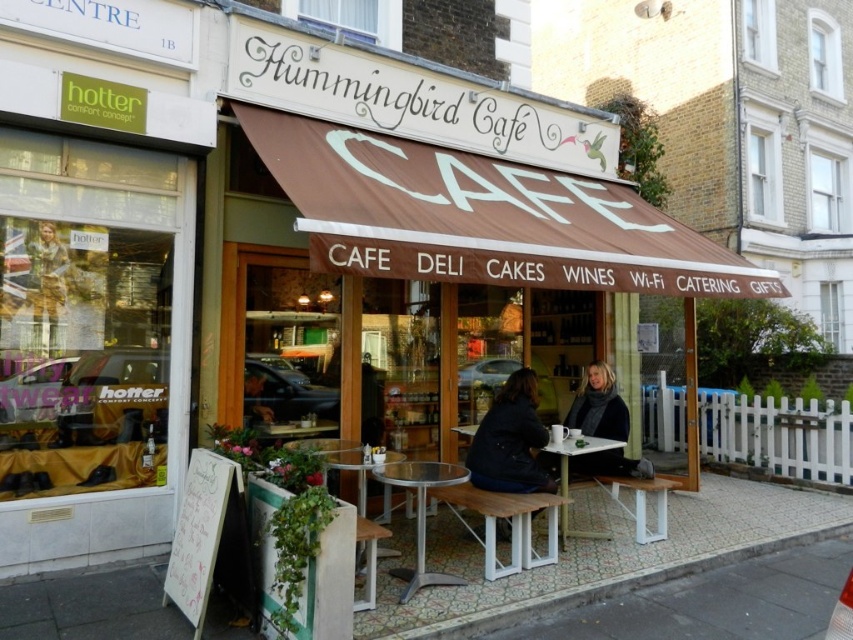
Is dark blue jacket at center positioned in front of metallic silver table at center?

That is False.

Does dark blue jacket at center have a greater width compared to metallic silver table at center?

Yes, dark blue jacket at center is wider than metallic silver table at center.

Who is more forward, (x=535, y=417) or (x=387, y=483)?

Point (x=387, y=483) is in front.

This screenshot has height=640, width=853. I want to click on dark blue jacket at center, so click(509, 440).

Is metallic silver table at center shorter than white plastic table at center?

Indeed, metallic silver table at center has a lesser height compared to white plastic table at center.

Does metallic silver table at center appear over white plastic table at center?

No.

Who is more forward, [405,464] or [558,476]?

Positioned in front is point [405,464].

The height and width of the screenshot is (640, 853). I want to click on metallic silver table at center, so click(x=419, y=515).

Does dark gray scarf at lower center have a larger size compared to metallic silver table at center?

Indeed, dark gray scarf at lower center has a larger size compared to metallic silver table at center.

Between dark gray scarf at lower center and metallic silver table at center, which one has less height?

With less height is metallic silver table at center.

Is point (572, 428) farther from viewer compared to point (434, 476)?

Yes.

Identify the location of dark gray scarf at lower center. (598, 404).